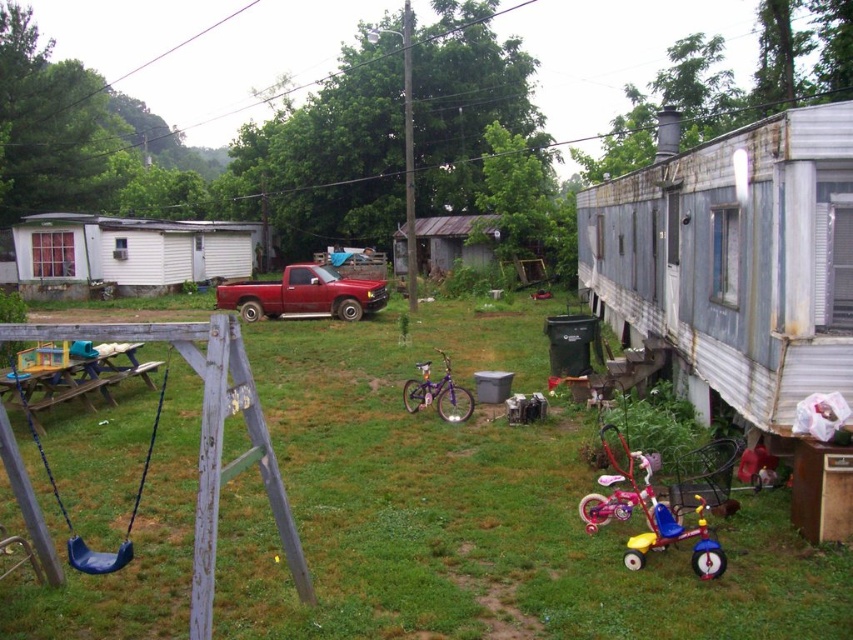
Question: Which point is farther to the camera?

Choices:
 (A) metallic red truck at center
 (B) green grass at center

Answer: (A)

Question: Is green grass at center thinner than blue plastic swing at lower left?

Choices:
 (A) no
 (B) yes

Answer: (A)

Question: Which of the following is the farthest from the observer?

Choices:
 (A) metallic pink tricycle at lower right
 (B) purple metallic bicycle at center

Answer: (B)

Question: Which point appears farthest from the camera in this image?

Choices:
 (A) (450, 420)
 (B) (318, 304)
 (C) (708, 616)

Answer: (B)

Question: Can you confirm if metallic red truck at center is thinner than blue plastic swing at lower left?

Choices:
 (A) no
 (B) yes

Answer: (A)

Question: Can you confirm if green grass at center is smaller than metallic red truck at center?

Choices:
 (A) no
 (B) yes

Answer: (B)